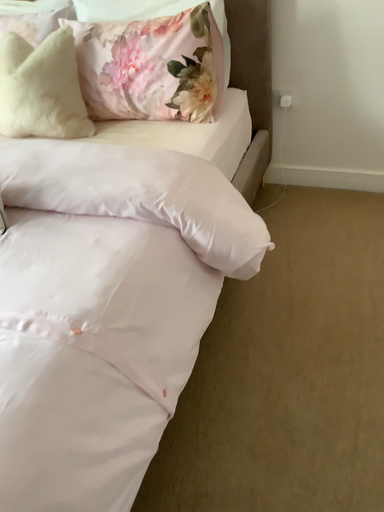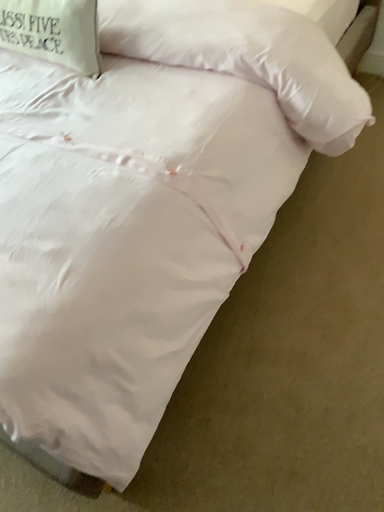
Question: Which way did the camera rotate in the video?

Choices:
 (A) rotated upward
 (B) rotated downward

Answer: (B)